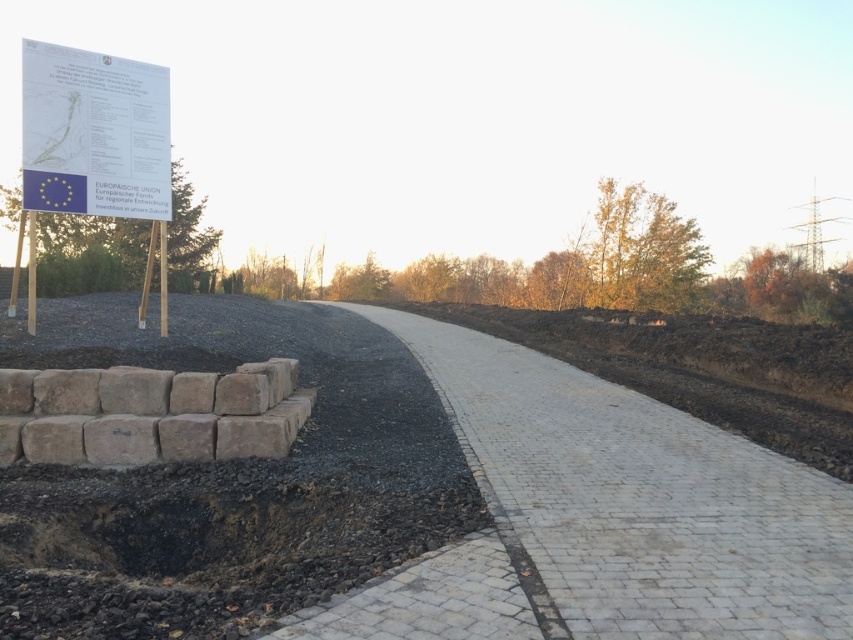
You are a delivery truck driver who needs to park your truck near the construction site. You see the black gravel at lower left and the white brick pavement at center. Which area is wider to safely park your truck?

The black gravel at lower left is wider than the white brick pavement at center, so it is safer to park there.

You are a construction worker who needs to place a new paving stone on the pathway. You have two options for placement areas near the pathway edge. One area is the black gravel at lower left and the other is the brown stone wall at lower left. Which area is higher in elevation?

The black gravel at lower left is above the brown stone wall at lower left, so the black gravel at lower left is higher in elevation.